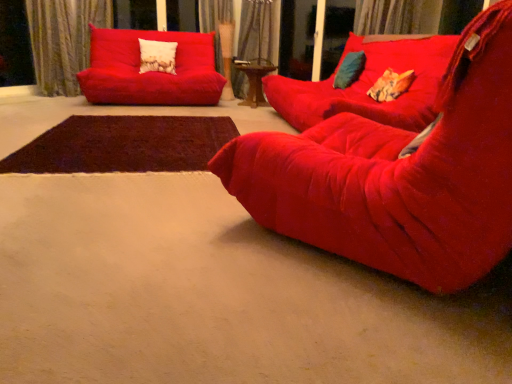
Measure the distance between point (361, 72) and camera.

4.06 meters.

Identify the location of velvet red studio couch at center, which ranks as the 2th studio couch in front-to-back order. (369, 85).

Locate an element on the screen. velvet red studio couch at right, placed as the first studio couch when sorted from front to back is located at coordinates (398, 175).

Image resolution: width=512 pixels, height=384 pixels. I want to click on brown shaggy rug at center, so click(123, 145).

How much space does orange fabric pillow at center, which appears as the 3th pillow when viewed from the top, occupy vertically?

10.58 inches.

Where is `orange fabric pillow at center, which is the 1th pillow from bottom to top`? This screenshot has height=384, width=512. orange fabric pillow at center, which is the 1th pillow from bottom to top is located at coordinates (391, 85).

You are a GUI agent. You are given a task and a screenshot of the screen. Output one action in this format:
    pyautogui.click(x=<x>, y=<y>)
    Task: Click on the velvety teal pillow at upper right, the 2th pillow when ordered from back to front
    This screenshot has width=512, height=384.
    Given the screenshot: What is the action you would take?
    pyautogui.click(x=349, y=70)

Can you confirm if velvet red studio couch at center, which ranks as the 2th studio couch in front-to-back order, is smaller than velvet curtain at upper left, which appears as the third curtain when viewed from the right?

No, velvet red studio couch at center, which ranks as the 2th studio couch in front-to-back order, is not smaller than velvet curtain at upper left, which appears as the third curtain when viewed from the right.

Considering the relative sizes of velvet red studio couch at center, placed as the 2th studio couch when sorted from back to front, and velvet curtain at upper left, which appears as the 1th curtain when viewed from the left, in the image provided, is velvet red studio couch at center, placed as the 2th studio couch when sorted from back to front, thinner than velvet curtain at upper left, which appears as the 1th curtain when viewed from the left,?

In fact, velvet red studio couch at center, placed as the 2th studio couch when sorted from back to front, might be wider than velvet curtain at upper left, which appears as the 1th curtain when viewed from the left.

Which object is more forward, velvet red studio couch at center, which ranks as the 2th studio couch in front-to-back order, or velvet curtain at upper left, which appears as the third curtain when viewed from the right?

velvet red studio couch at center, which ranks as the 2th studio couch in front-to-back order, is closer to the camera.

From the image's perspective, which is above, velvet red studio couch at center, which ranks as the 2th studio couch in front-to-back order, or velvet curtain at upper left, which appears as the third curtain when viewed from the right?

velvet curtain at upper left, which appears as the third curtain when viewed from the right.

Which point is more distant from viewer, (162, 49) or (261, 77)?

The point (162, 49) is farther from the camera.

In the image, is velvet textured pillow at upper center, the 3th pillow from the right, positioned in front of or behind woodenmaterial/texturetable at center?

Visually, velvet textured pillow at upper center, the 3th pillow from the right, is located behind woodenmaterial/texturetable at center.

The image size is (512, 384). Identify the location of table below the velvet textured pillow at upper center, which appears as the 3th pillow when viewed from the front (from the image's perspective). click(255, 80).

Is velvet textured pillow at upper center, the third pillow when ordered from bottom to top, wider than woodenmaterial/texturetable at center?

No.

From the image's perspective, would you say velvet red studio couch at center, which ranks as the 2th studio couch in front-to-back order, is shown under velvet textured pillow at upper center, which appears as the 3th pillow when viewed from the front?

Yes, from the image's perspective, velvet red studio couch at center, which ranks as the 2th studio couch in front-to-back order, is below velvet textured pillow at upper center, which appears as the 3th pillow when viewed from the front.

Is velvet red studio couch at center, which ranks as the 2th studio couch in front-to-back order, oriented towards velvet textured pillow at upper center, the third pillow when ordered from bottom to top?

No.

There is a velvet red studio couch at center, placed as the 2th studio couch when sorted from back to front. Where is `the 2nd pillow above it (from the image's perspective)`? This screenshot has height=384, width=512. the 2nd pillow above it (from the image's perspective) is located at coordinates (157, 56).

Who is more distant, velvet red studio couch at center, which ranks as the 2th studio couch in front-to-back order, or velvet textured pillow at upper center, acting as the first pillow starting from the back?

velvet textured pillow at upper center, acting as the first pillow starting from the back, is more distant.

Does brown shaggy rug at center have a smaller size compared to orange fabric pillow at center, which is the 1th pillow from bottom to top?

Incorrect, brown shaggy rug at center is not smaller in size than orange fabric pillow at center, which is the 1th pillow from bottom to top.

Considering the sizes of objects brown shaggy rug at center and orange fabric pillow at center, which is the 3th pillow from left to right, in the image provided, who is wider, brown shaggy rug at center or orange fabric pillow at center, which is the 3th pillow from left to right,?

With larger width is brown shaggy rug at center.

Considering the relative positions of brown shaggy rug at center and orange fabric pillow at center, which is the 1th pillow in right-to-left order, in the image provided, is brown shaggy rug at center to the right of orange fabric pillow at center, which is the 1th pillow in right-to-left order, from the viewer's perspective?

Incorrect, brown shaggy rug at center is not on the right side of orange fabric pillow at center, which is the 1th pillow in right-to-left order.

Is brown shaggy rug at center far from orange fabric pillow at center, the 1th pillow viewed from the front?

Yes, brown shaggy rug at center and orange fabric pillow at center, the 1th pillow viewed from the front, are located far from each other.

From the picture: Between velvet curtain at upper left, which appears as the 1th curtain when viewed from the left, and velvet curtain at upper center, arranged as the 2th curtain when viewed from the right, which one has smaller width?

Thinner between the two is velvet curtain at upper center, arranged as the 2th curtain when viewed from the right.

Does point (31, 27) come closer to viewer compared to point (217, 71)?

Yes.

From the image's perspective, between velvet curtain at upper left, which appears as the 1th curtain when viewed from the left, and velvet curtain at upper center, arranged as the 2th curtain when viewed from the right, who is located below?

velvet curtain at upper left, which appears as the 1th curtain when viewed from the left.

Could you tell me if velvet curtain at upper left, which appears as the 1th curtain when viewed from the left, is facing velvet curtain at upper center, arranged as the 2th curtain when viewed from the right?

No, velvet curtain at upper left, which appears as the 1th curtain when viewed from the left, is not oriented towards velvet curtain at upper center, arranged as the 2th curtain when viewed from the right.

Is velvet textured pillow at upper center, which is the first pillow in top-to-bottom order, at the left side of matte red studio couch at upper left, marked as the 1th studio couch in a back-to-front arrangement?

Yes, velvet textured pillow at upper center, which is the first pillow in top-to-bottom order, is to the left of matte red studio couch at upper left, marked as the 1th studio couch in a back-to-front arrangement.

Is velvet textured pillow at upper center, acting as the first pillow starting from the back, far from matte red studio couch at upper left, marked as the 1th studio couch in a back-to-front arrangement?

No, velvet textured pillow at upper center, acting as the first pillow starting from the back, is not far from matte red studio couch at upper left, marked as the 1th studio couch in a back-to-front arrangement.

Consider the image. How far apart are velvet textured pillow at upper center, which is the first pillow in left-to-right order, and matte red studio couch at upper left, marked as the 1th studio couch in a back-to-front arrangement?

velvet textured pillow at upper center, which is the first pillow in left-to-right order, is 11.94 inches away from matte red studio couch at upper left, marked as the 1th studio couch in a back-to-front arrangement.

Does velvet textured pillow at upper center, acting as the first pillow starting from the back, have a smaller size compared to matte red studio couch at upper left, marked as the 3th studio couch in a front-to-back arrangement?

Yes.

From the image's perspective, is velvet curtain at upper center, the 2th curtain when ordered from left to right, under orange fabric pillow at center, which is the 1th pillow from bottom to top?

Incorrect, from the image's perspective, velvet curtain at upper center, the 2th curtain when ordered from left to right, is higher than orange fabric pillow at center, which is the 1th pillow from bottom to top.

How different are the orientations of velvet curtain at upper center, arranged as the 2th curtain when viewed from the right, and orange fabric pillow at center, positioned as the third pillow in back-to-front order, in degrees?

velvet curtain at upper center, arranged as the 2th curtain when viewed from the right, and orange fabric pillow at center, positioned as the third pillow in back-to-front order, are facing 94.9 degrees away from each other.

Does velvet curtain at upper center, the 2th curtain when ordered from left to right, appear on the left side of orange fabric pillow at center, the 1th pillow viewed from the front?

Indeed, velvet curtain at upper center, the 2th curtain when ordered from left to right, is positioned on the left side of orange fabric pillow at center, the 1th pillow viewed from the front.

Is velvet curtain at upper center, the 2th curtain when ordered from left to right, not near orange fabric pillow at center, which appears as the 3th pillow when viewed from the top?

Indeed, velvet curtain at upper center, the 2th curtain when ordered from left to right, is not near orange fabric pillow at center, which appears as the 3th pillow when viewed from the top.

From the image's perspective, starting from the velvet red studio couch at center, placed as the 2th studio couch when sorted from back to front, which curtain is the 1st one above? Please provide its 2D coordinates.

[(63, 40)]

Image resolution: width=512 pixels, height=384 pixels. What are the coordinates of `table located on the right of velvet textured pillow at upper center, the 3th pillow from the right` in the screenshot? It's located at (255, 80).

Considering their positions, is orange fabric pillow at center, the 1th pillow viewed from the front, positioned further to brown shaggy rug at center than matte red studio couch at upper left, marked as the 1th studio couch in a back-to-front arrangement?

The object further to brown shaggy rug at center is orange fabric pillow at center, the 1th pillow viewed from the front.

Estimate the real-world distances between objects in this image. Which object is closer to velvet textured pillow at upper center, the third pillow when ordered from bottom to top, velvet curtain at upper left, which appears as the third curtain when viewed from the right, or woodenmaterial/texturetable at center?

woodenmaterial/texturetable at center.

Based on the photo, when comparing their distances from velvet curtain at upper left, which appears as the 1th curtain when viewed from the left, does velvety teal pillow at upper right, which ranks as the second pillow in bottom-to-top order, or velvet red studio couch at center, which ranks as the 2th studio couch in front-to-back order, seem closer?

velvet red studio couch at center, which ranks as the 2th studio couch in front-to-back order, is closer to velvet curtain at upper left, which appears as the 1th curtain when viewed from the left.

Estimate the real-world distances between objects in this image. Which object is closer to velvet cushion at upper right, velvety teal pillow at upper right, the 2th pillow in the right-to-left sequence, or velvet curtain at upper center, placed as the 1th curtain when sorted from right to left?

Among the two, velvet curtain at upper center, placed as the 1th curtain when sorted from right to left, is located nearer to velvet cushion at upper right.

Based on their spatial positions, is velvet cushion at upper right or matte red studio couch at upper left, marked as the 3th studio couch in a front-to-back arrangement, further from velvet red studio couch at center, which ranks as the 2th studio couch in front-to-back order?

matte red studio couch at upper left, marked as the 3th studio couch in a front-to-back arrangement.

Estimate the real-world distances between objects in this image. Which object is closer to brown shaggy rug at center, velvet curtain at upper center, the 2th curtain when ordered from left to right, or velvet curtain at upper left, which appears as the third curtain when viewed from the right?

Based on the image, velvet curtain at upper left, which appears as the third curtain when viewed from the right, appears to be nearer to brown shaggy rug at center.

Considering their positions, is velvet curtain at upper center, placed as the 1th curtain when sorted from right to left, positioned further to velvety teal pillow at upper right, which is the 2th pillow in top-to-bottom order, than brown shaggy rug at center?

brown shaggy rug at center.

Which object lies nearer to the anchor point velvety teal pillow at upper right, which ranks as the second pillow in bottom-to-top order, velvet curtain at upper center, the 3th curtain positioned from the left, or velvet red studio couch at center, placed as the 2th studio couch when sorted from back to front?

velvet red studio couch at center, placed as the 2th studio couch when sorted from back to front.

I want to click on studio couch between velvet red studio couch at center, which ranks as the 2th studio couch in front-to-back order, and velvet textured pillow at upper center, which is the first pillow in top-to-bottom order, from front to back, so point(150,72).

You are a GUI agent. You are given a task and a screenshot of the screen. Output one action in this format:
    pyautogui.click(x=<x>, y=<y>)
    Task: Click on the studio couch located between brown shaggy rug at center and velvet red studio couch at center, which ranks as the 2th studio couch in front-to-back order, in the left-right direction
    
    Given the screenshot: What is the action you would take?
    pyautogui.click(x=398, y=175)

Locate an element on the screen. table positioned between velvet red studio couch at right, placed as the first studio couch when sorted from front to back, and velvet textured pillow at upper center, which is the first pillow in left-to-right order, from near to far is located at coordinates 255,80.

At what (x,y) coordinates should I click in order to perform the action: click on studio couch between velvet curtain at upper left, which appears as the third curtain when viewed from the right, and velvet curtain at upper center, placed as the 1th curtain when sorted from right to left. Please return your answer as a coordinate pair (x, y). Looking at the image, I should click on (150, 72).